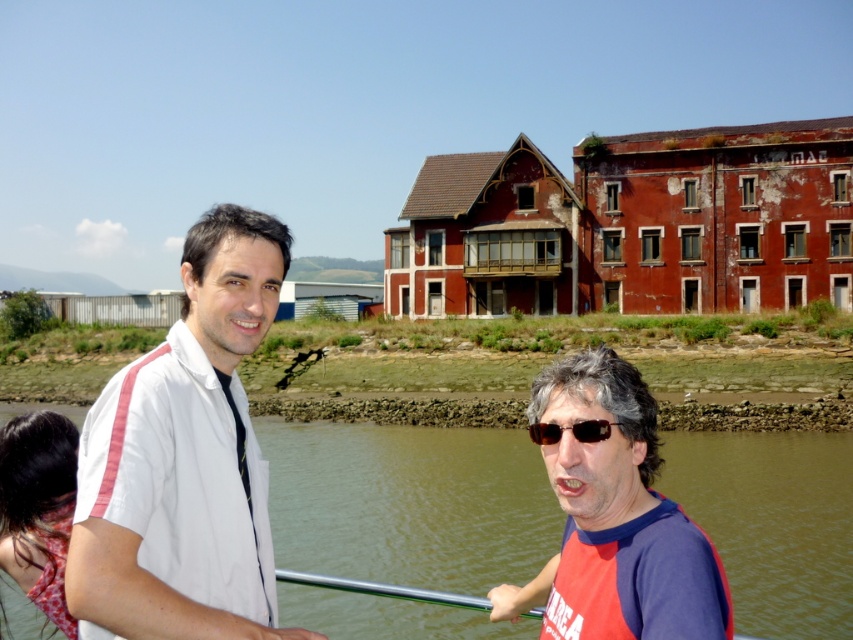
You are a photographer trying to capture a clear shot of the matte red scarf at lower left. However, the white fabric shirt at left is blocking your view. Can you adjust your position to see the scarf without moving the subjects?

The white fabric shirt at left is in front of the matte red scarf at lower left, so you can move your camera angle slightly to the right or lower to see around the shirt and capture the scarf without moving the subjects.

From the picture: You are a photographer trying to capture a photo of the brown water at lower center and the matte red scarf at lower left. Which object should you focus on first if you want to include both in the frame without moving the camera?

The brown water at lower center is bigger than the matte red scarf at lower left, so you should focus on the brown water at lower center first to ensure it fits properly in the frame.

You are a photographer trying to capture a photo of the brown water at lower center and the matte red scarf at lower left. Which object is wider in the image?

The brown water at lower center is wider than the matte red scarf at lower left according to the description.